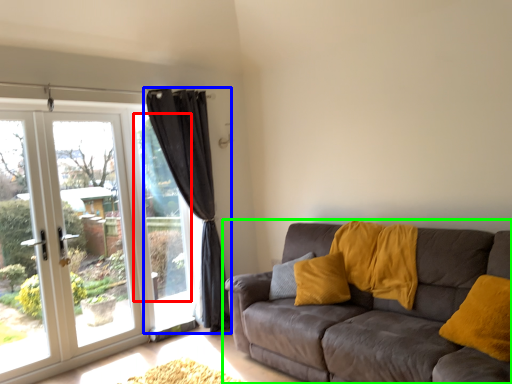
Question: Estimate the real-world distances between objects in this image. Which object is farther from window screen (highlighted by a red box), curtain (highlighted by a blue box) or studio couch (highlighted by a green box)?

Choices:
 (A) curtain
 (B) studio couch

Answer: (B)